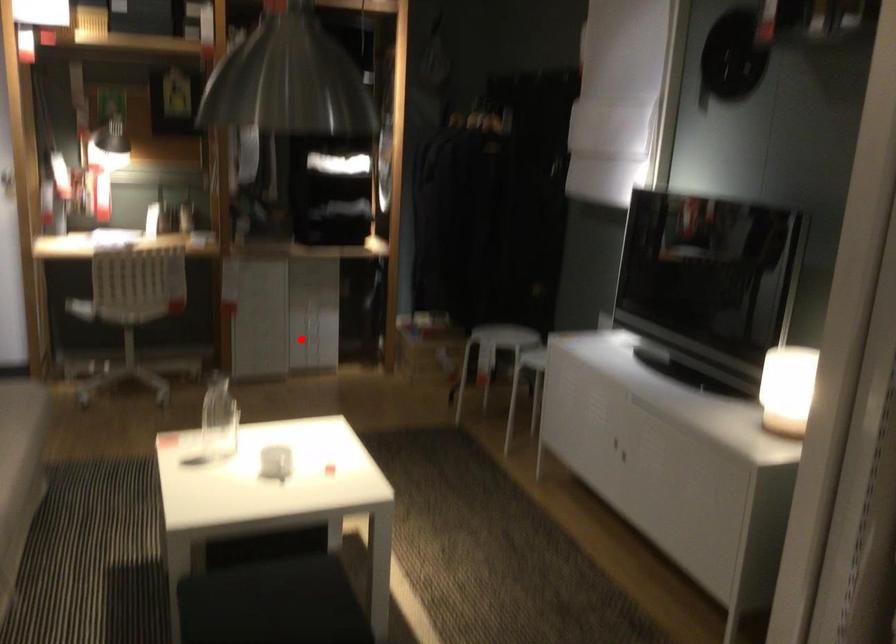
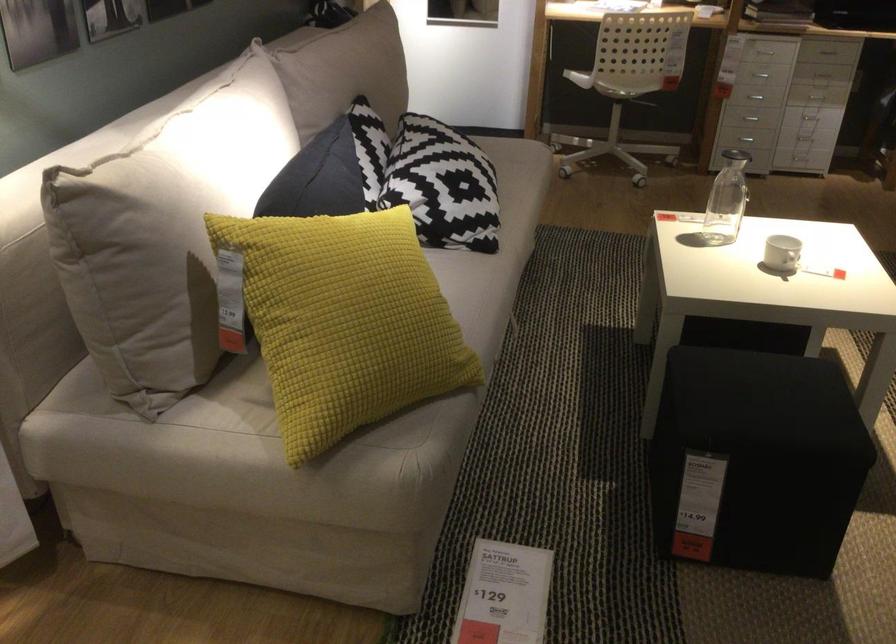
Question: I am providing you with two images of the same scene from different viewpoints. In image1, a red point is highlighted. Considering the same 3D point in image2, which of the following is correct?

Choices:
 (A) It is closer
 (B) It is farther

Answer: (A)